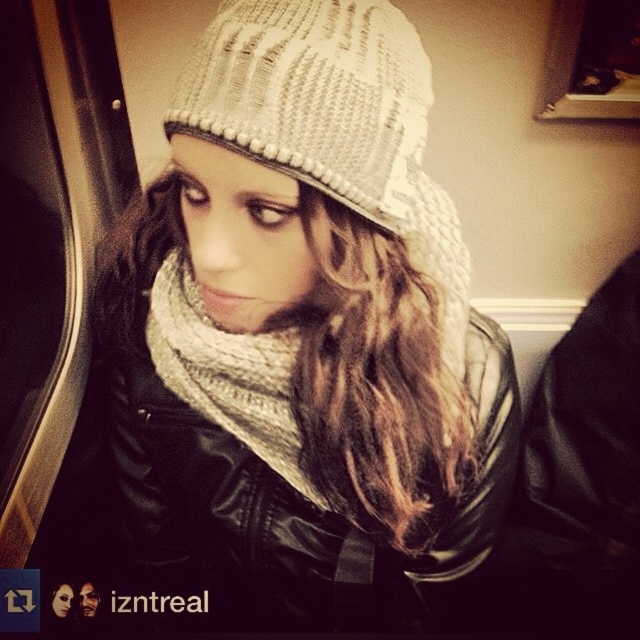
Does white knitted hat at center have a greater height compared to knitted beige scarf at center?

Indeed, white knitted hat at center has a greater height compared to knitted beige scarf at center.

Between white knitted hat at center and knitted beige scarf at center, which one is positioned higher?

white knitted hat at center

Does point (257, 556) lie in front of point (179, 253)?

That is False.

At what (x,y) coordinates should I click in order to perform the action: click on white knitted hat at center. Please return your answer as a coordinate pair (x, y). The width and height of the screenshot is (640, 640). Looking at the image, I should click on (304, 330).

Who is lower down, white knitted hat at center or knitted beige hat at center?

Positioned lower is white knitted hat at center.

Which of these two, white knitted hat at center or knitted beige hat at center, stands shorter?

knitted beige hat at center

Between point (204, 417) and point (323, 45), which one is positioned behind?

The point (204, 417) is behind.

Identify the location of white knitted hat at center. The image size is (640, 640). (304, 330).

Consider the image. Which is more to the right, knitted beige hat at center or knitted beige scarf at center?

Positioned to the right is knitted beige hat at center.

Does knitted beige hat at center have a greater height compared to knitted beige scarf at center?

Yes, knitted beige hat at center is taller than knitted beige scarf at center.

Is point (276, 67) positioned after point (248, 380)?

No.

The width and height of the screenshot is (640, 640). In order to click on knitted beige hat at center in this screenshot , I will do `click(333, 120)`.